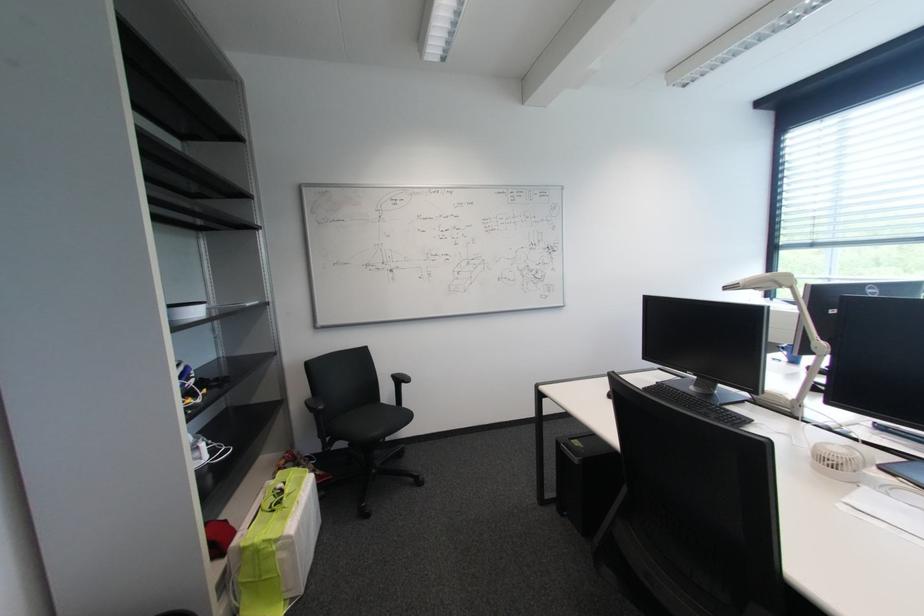
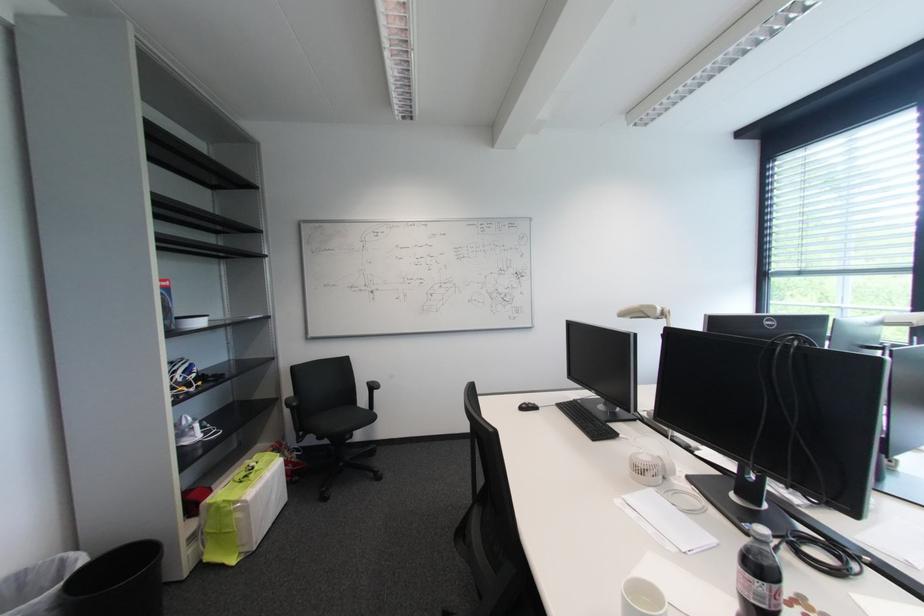
Locate, in the second image, the point that corresponds to [271,543] in the first image.

(231, 503)